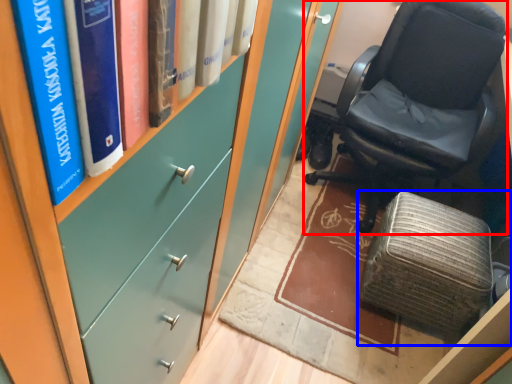
Question: Among these objects, which one is nearest to the camera, chair (highlighted by a red box) or furniture (highlighted by a blue box)?

Choices:
 (A) chair
 (B) furniture

Answer: (A)